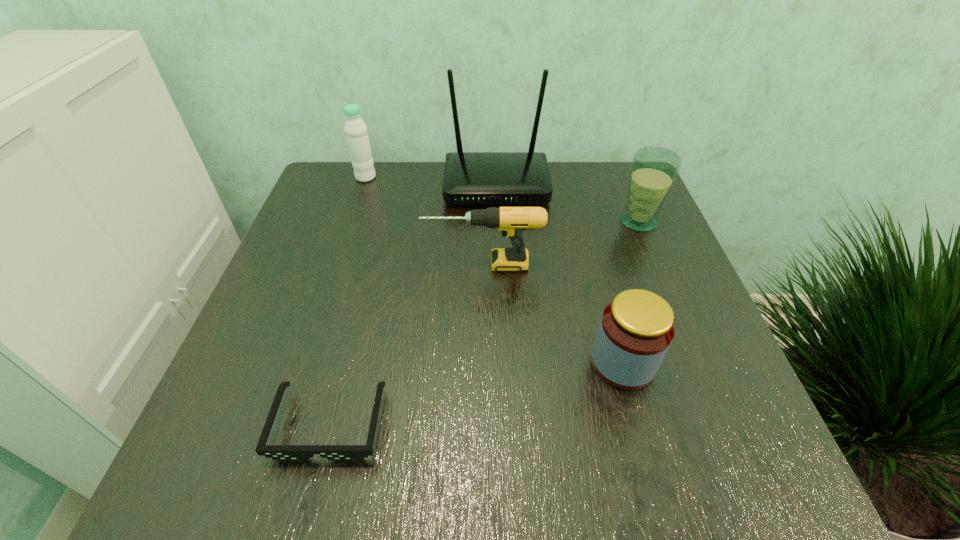
Where is `vacant area that lies between the water bottle and the router`? vacant area that lies between the water bottle and the router is located at coordinates (431, 181).

Where is `vacant area that lies between the rightmost object and the sunglasses`? The width and height of the screenshot is (960, 540). vacant area that lies between the rightmost object and the sunglasses is located at coordinates (484, 322).

Locate an element on the screen. free space between the water bottle and the sunglasses is located at coordinates pyautogui.click(x=348, y=300).

This screenshot has height=540, width=960. What are the coordinates of `empty space between the fifth object from left to right and the sunglasses` in the screenshot? It's located at (476, 393).

Where is `free spot between the router and the fifth object from left to right`? The height and width of the screenshot is (540, 960). free spot between the router and the fifth object from left to right is located at coordinates (560, 274).

This screenshot has width=960, height=540. Find the location of `vacant space that is in between the router and the jar`. vacant space that is in between the router and the jar is located at coordinates (560, 274).

The image size is (960, 540). In order to click on vacant area between the drill and the glass in this screenshot , I will do `click(561, 243)`.

Locate an element on the screen. The height and width of the screenshot is (540, 960). blank region between the fourth farthest object and the rightmost object is located at coordinates (561, 243).

Find the location of a particular element. The height and width of the screenshot is (540, 960). object that is the third closest to the fifth object from left to right is located at coordinates (284, 453).

The image size is (960, 540). In order to click on object identified as the closest to the second object from right to left in this screenshot , I will do `click(512, 221)`.